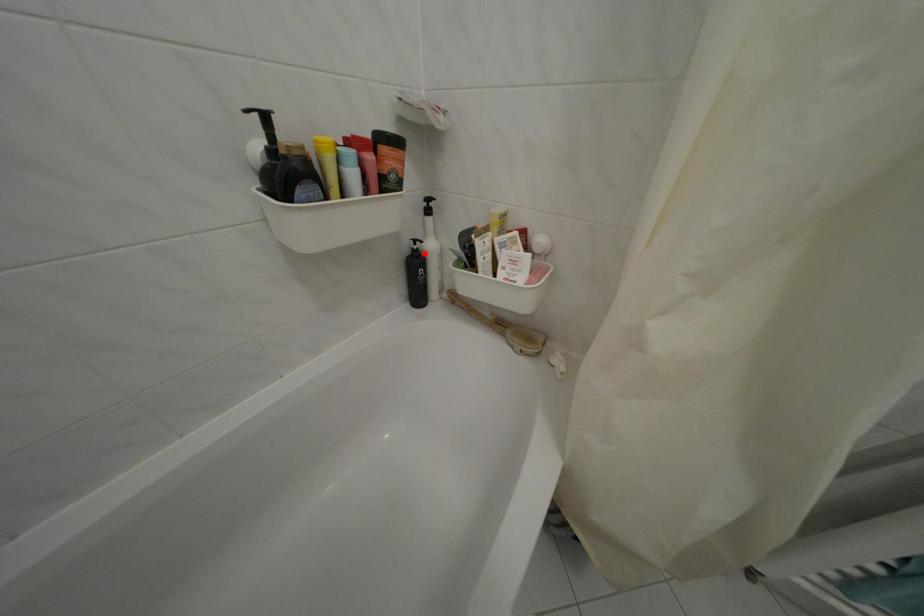
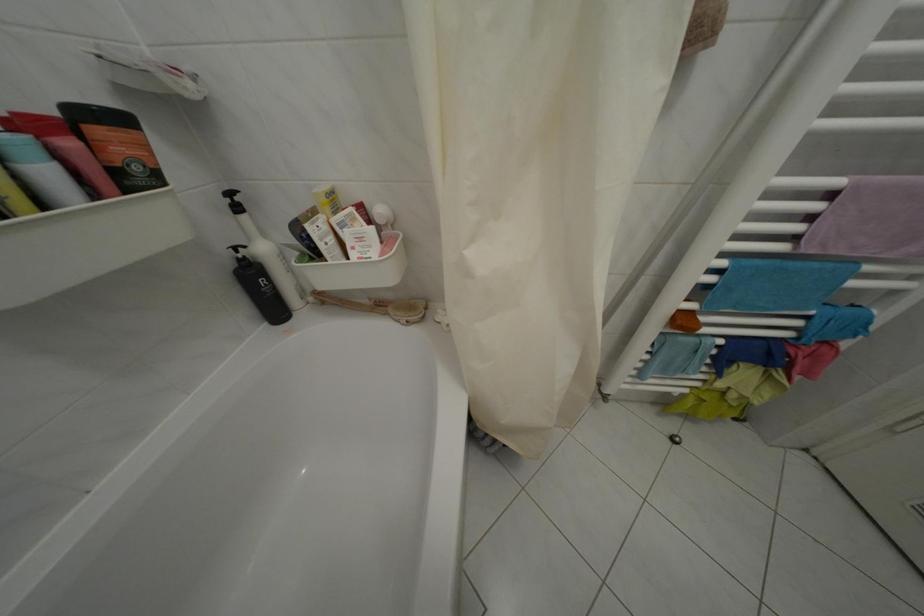
Locate, in the second image, the point that corresponds to the highlighted location in the first image.

(249, 262)